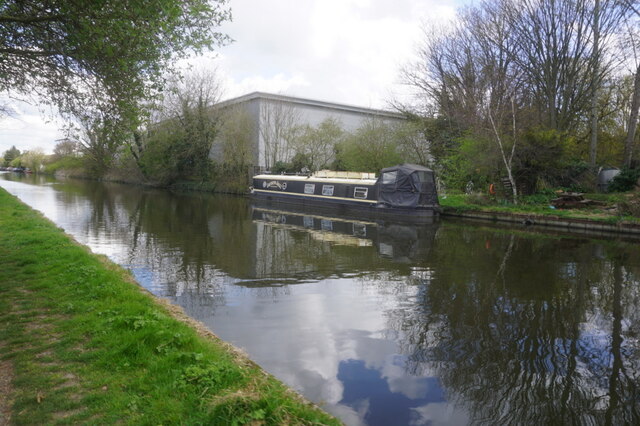
Where is `canopy`? Image resolution: width=640 pixels, height=426 pixels. canopy is located at coordinates pyautogui.click(x=400, y=190).